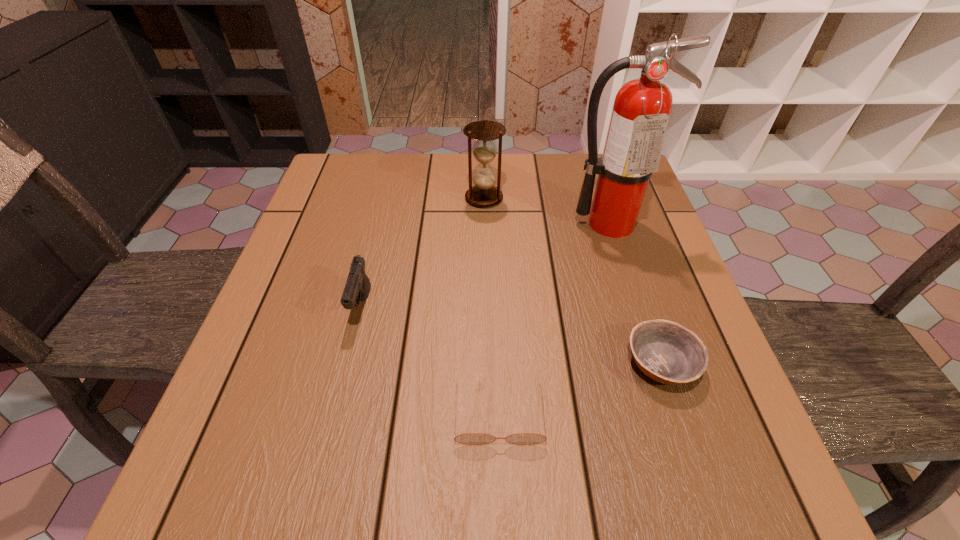
Locate an element on the screen. vacant space that satisfies the following two spatial constraints: 1. at the barrel of the bowl; 2. on the right side of the leftmost object is located at coordinates (348, 363).